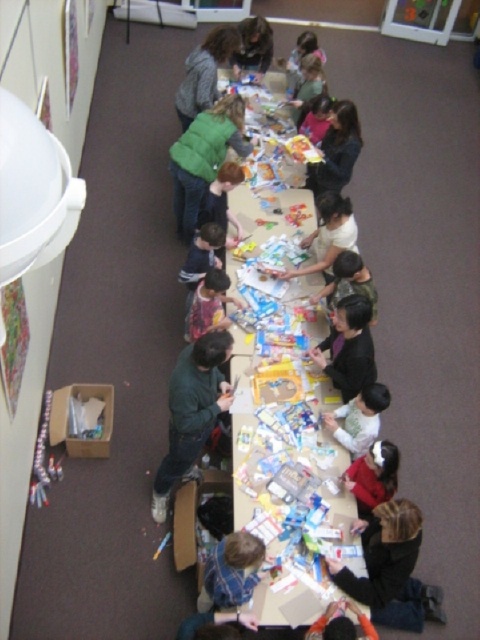
Is the position of green fuzzy sweater at center less distant than that of plaid shirt at center?

That is False.

Who is more distant from viewer, [190,163] or [207,300]?

The point [190,163] is behind.

What do you see at coordinates (204, 157) in the screenshot? I see `green fuzzy sweater at center` at bounding box center [204, 157].

Identify the location of green fuzzy sweater at center. (204, 157).

Is dark green sweater at center shorter than green fuzzy sweater at upper center?

No, dark green sweater at center is not shorter than green fuzzy sweater at upper center.

Is point (206, 353) positioned after point (228, 38)?

No, it is not.

Between point (159, 472) and point (184, 88), which one is positioned in front?

Point (159, 472)

Identify the location of dark green sweater at center. The height and width of the screenshot is (640, 480). (192, 410).

Which is more to the left, dark green sweater at center or white matte shirt at lower center?

Positioned to the left is dark green sweater at center.

Is dark green sweater at center to the right of white matte shirt at lower center from the viewer's perspective?

Incorrect, dark green sweater at center is not on the right side of white matte shirt at lower center.

Is point (169, 442) closer to camera compared to point (368, 387)?

No, (169, 442) is further to viewer.

At what (x,y) coordinates should I click in order to perform the action: click on dark green sweater at center. Please return your answer as a coordinate pair (x, y). This screenshot has height=640, width=480. Looking at the image, I should click on (192, 410).